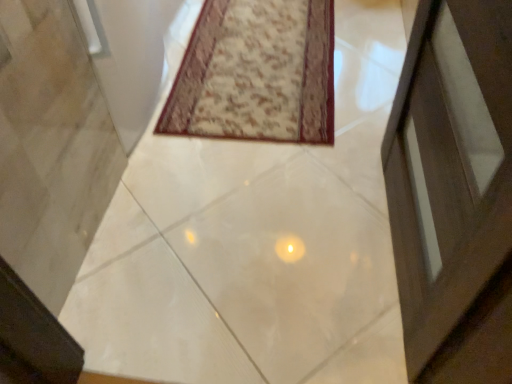
This screenshot has width=512, height=384. I want to click on free space above white glossy concrete at center (from a real-world perspective), so click(305, 108).